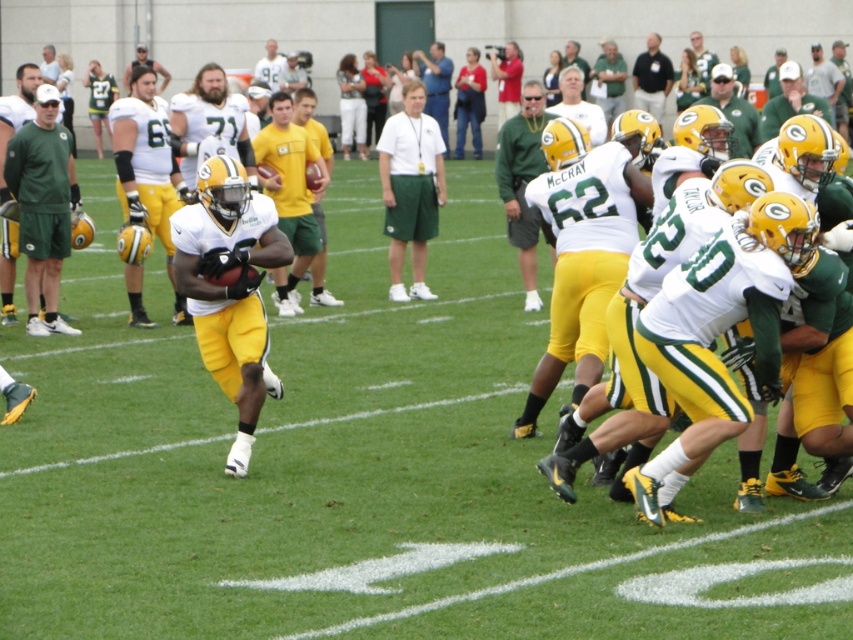
Can you confirm if black shirt at upper right is thinner than matte white jersey at upper center?

Incorrect, black shirt at upper right's width is not less than matte white jersey at upper center's.

Does black shirt at upper right have a greater width compared to matte white jersey at upper center?

Yes, black shirt at upper right is wider than matte white jersey at upper center.

Which is in front, point (657, 118) or point (265, 74)?

Point (657, 118)

The height and width of the screenshot is (640, 853). Identify the location of black shirt at upper right. (651, 77).

Is green matte jersey at center above blue shirt at center?

No, green matte jersey at center is not above blue shirt at center.

Between green matte jersey at center and blue shirt at center, which one has more height?

With more height is blue shirt at center.

Find the location of a particular element. This screenshot has height=640, width=853. green matte jersey at center is located at coordinates (523, 182).

Is the position of matte green shorts at left more distant than that of white shirt at upper left?

No, matte green shorts at left is closer to the viewer.

Is matte green shorts at left shorter than white shirt at upper left?

No.

Is point (10, 252) in front of point (44, 61)?

Yes.

The width and height of the screenshot is (853, 640). I want to click on matte green shorts at left, so click(x=16, y=113).